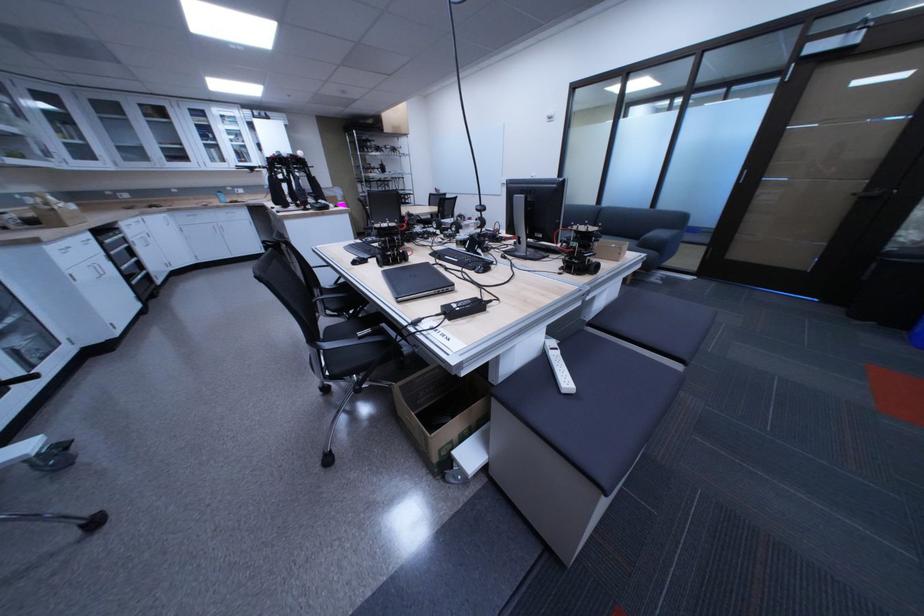
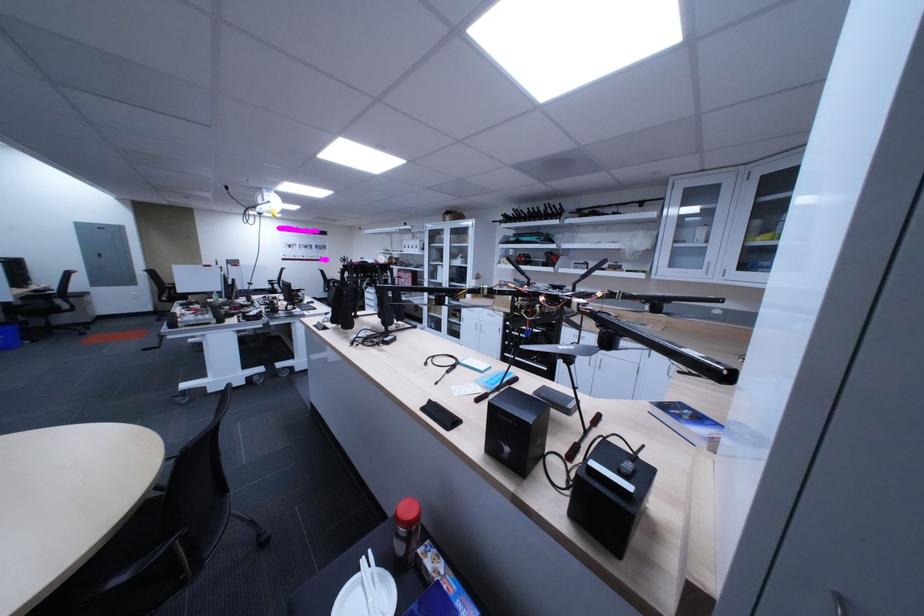
Locate, in the second image, the point that corresponds to pixel 91 282 in the first image.

(478, 323)